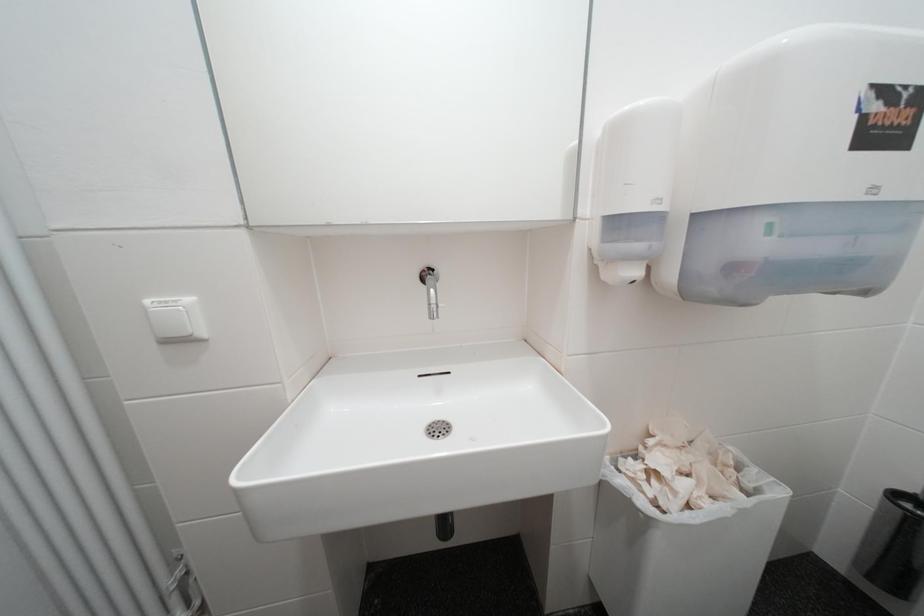
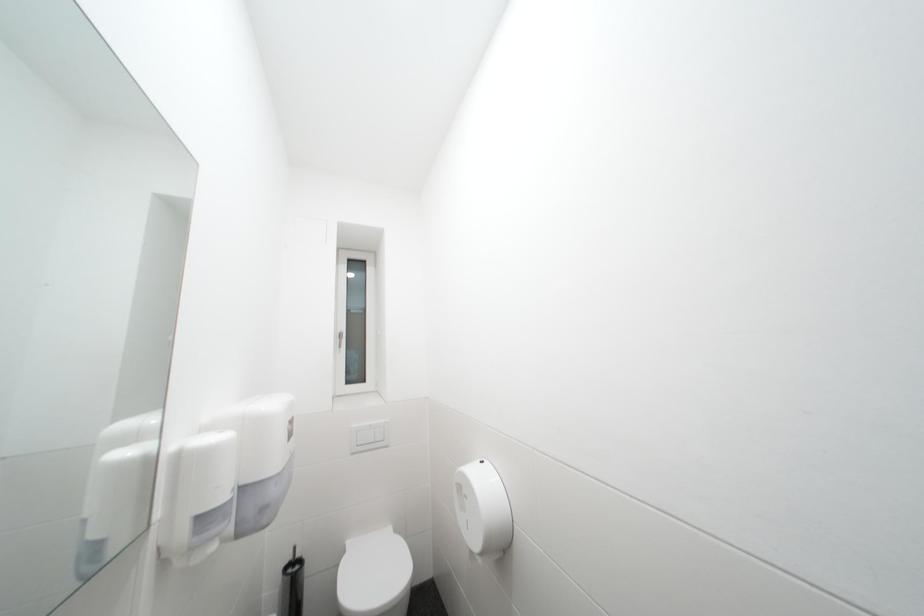
Question: The images are taken continuously from a first-person perspective. In which direction is your viewpoint rotating?

Choices:
 (A) Left
 (B) Right
 (C) Up
 (D) Down

Answer: (B)